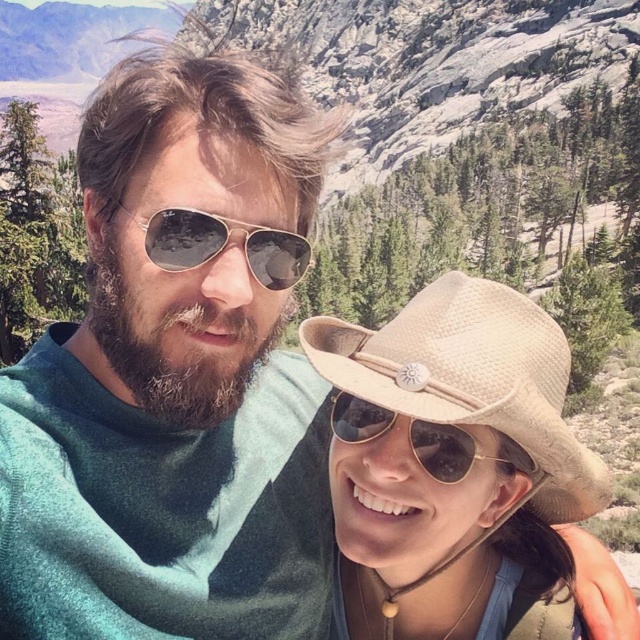
You are taking a photo of the two people in the scene. You want to focus on the person closer to the camera. Which point should you focus on, point (467, 358) or point (468, 465)?

Point (467, 358) is further to the camera than point (468, 465), so you should focus on point (467, 358) to capture the person closer to the camera.

You are a photographer trying to capture a clear shot of both the beige straw cowboy hat at center and the sunglasses at center in the image. Since the camera can only focus on one object at a time, which object should you choose to ensure the other remains recognizable in the background?

The beige straw cowboy hat at center is larger in size than sunglasses at center. To ensure the sunglasses at center remain recognizable in the background, you should focus on the larger beige straw cowboy hat at center.